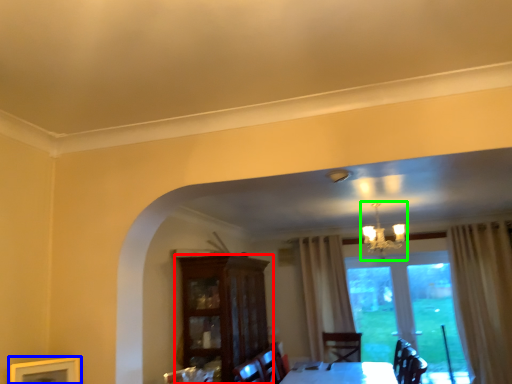
Question: Estimate the real-world distances between objects in this image. Which object is closer to cabinetry (highlighted by a red box), picture frame (highlighted by a blue box) or light fixture (highlighted by a green box)?

Choices:
 (A) picture frame
 (B) light fixture

Answer: (A)